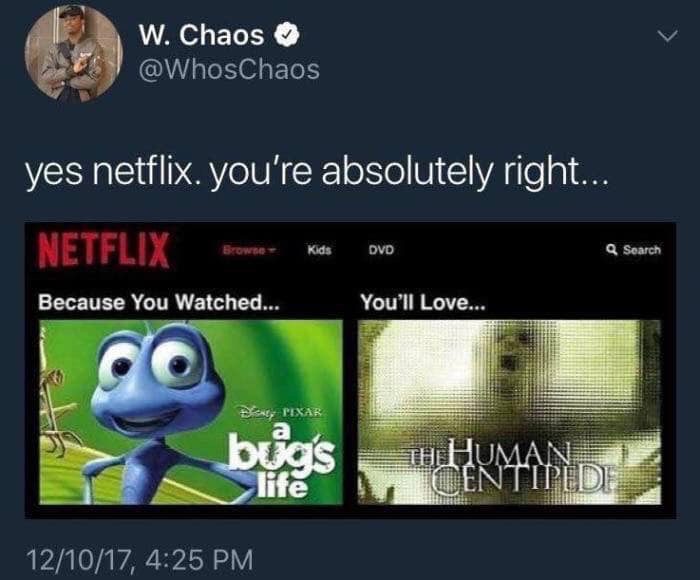
I want to click on chest, so click(x=136, y=482).